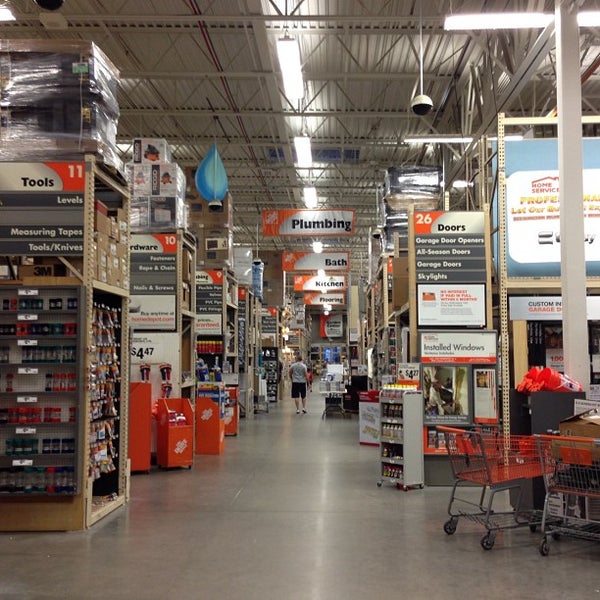
Where is `floor`? floor is located at coordinates (279, 543).